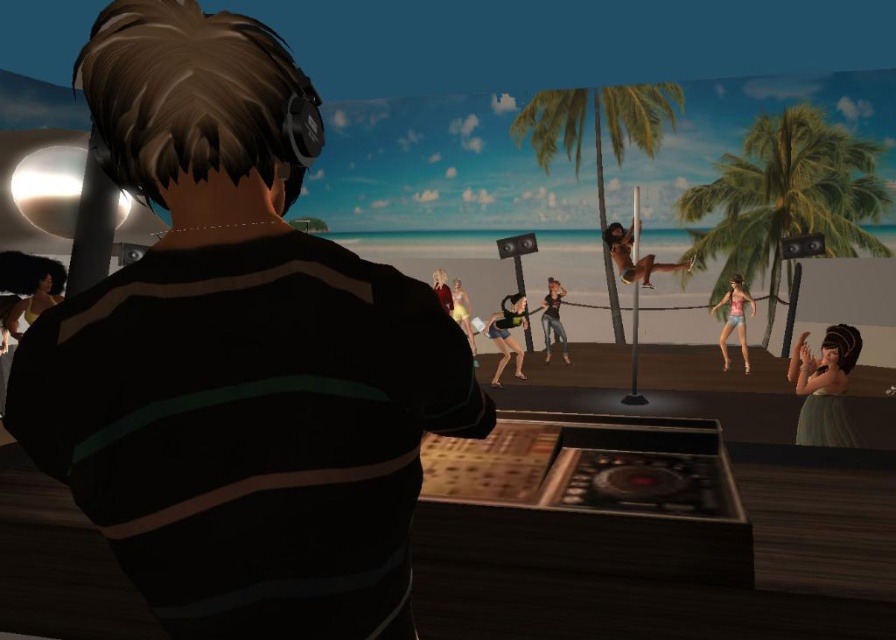
Which is more to the right, striped fabric shirt at center or smooth skin at center?

smooth skin at center is more to the right.

Image resolution: width=896 pixels, height=640 pixels. Identify the location of striped fabric shirt at center. (238, 355).

Find the location of a particular element. Image resolution: width=896 pixels, height=640 pixels. striped fabric shirt at center is located at coordinates (x=238, y=355).

Based on the photo, can you confirm if matte black bikini at center is positioned to the left of shiny black pole at center?

Indeed, matte black bikini at center is positioned on the left side of shiny black pole at center.

Who is taller, matte black bikini at center or shiny black pole at center?

shiny black pole at center

Identify the location of matte black bikini at center. (507, 333).

Between point (472, 333) and point (433, 288), which one is positioned in front?

Positioned in front is point (433, 288).

Which is more to the right, yellow matte swimsuit at center or smooth skin at center?

yellow matte swimsuit at center is more to the right.

This screenshot has height=640, width=896. Find the location of `yellow matte swimsuit at center`. yellow matte swimsuit at center is located at coordinates (462, 314).